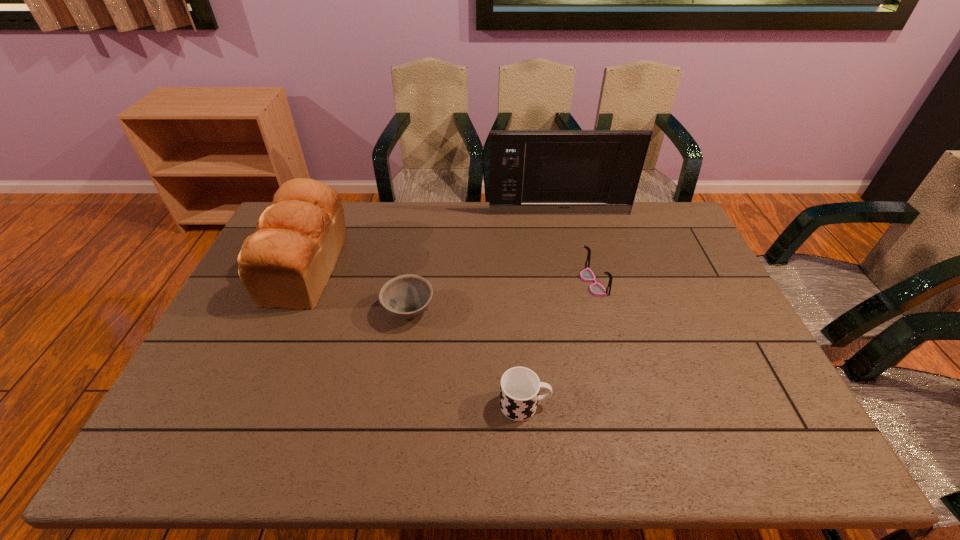
The image size is (960, 540). I want to click on the tallest object, so coord(540,172).

Image resolution: width=960 pixels, height=540 pixels. I want to click on the farthest object, so click(x=540, y=172).

Identify the location of the fourth shortest object. (287, 262).

What are the coordinates of `bread` in the screenshot? It's located at (287, 262).

Find the location of a particular element. The image size is (960, 540). the third shortest object is located at coordinates (587, 275).

Where is `cup`? The height and width of the screenshot is (540, 960). cup is located at coordinates (519, 391).

Where is `the fourth tallest object`? This screenshot has width=960, height=540. the fourth tallest object is located at coordinates (519, 391).

I want to click on bowl, so click(x=407, y=296).

Identify the location of the second object from left to right. (407, 296).

Where is `free space located on the front panel of the tallest object`? This screenshot has width=960, height=540. free space located on the front panel of the tallest object is located at coordinates (570, 262).